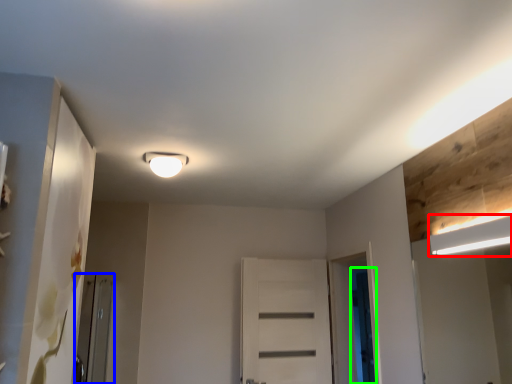
Question: Which object is positioned farthest from lamp (highlighted by a red box)? Select from screen door (highlighted by a blue box) and screen door (highlighted by a green box).

Choices:
 (A) screen door
 (B) screen door

Answer: (A)